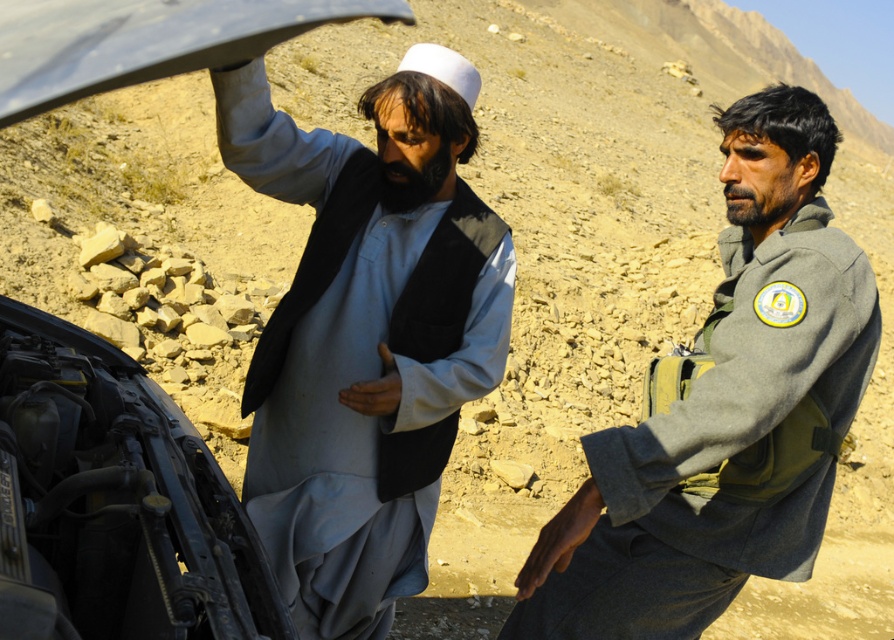
Consider the image. You are a repair technician standing 1.6 meters away from the metallic car hood at left. Can you comfortably reach the hood to inspect it without moving closer?

The metallic car hood at left is 1.69 meters away from you, so yes, you can comfortably reach it to inspect without moving closer since the distance is slightly more than your reach requirement.